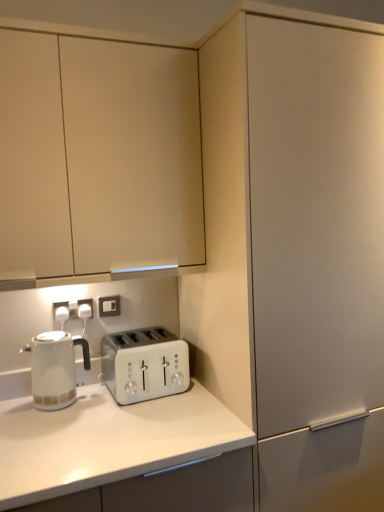
The width and height of the screenshot is (384, 512). What are the coordinates of `vacant region above white glossy kettle at left (from a real-world perspective)` in the screenshot? It's located at (46, 336).